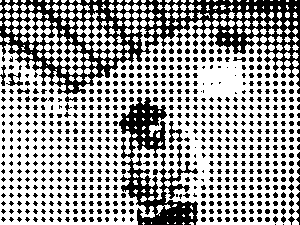
The width and height of the screenshot is (300, 225). Identify the location of ceiling. (87, 39).